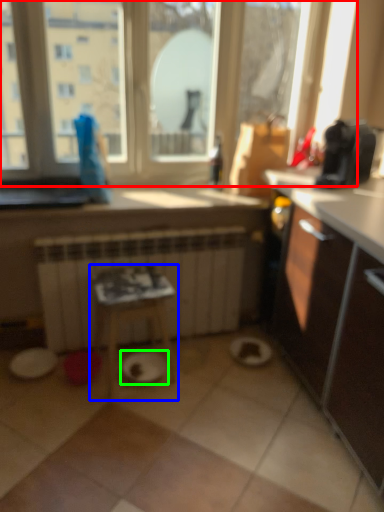
Question: Based on their relative distances, which object is farther from window (highlighted by a red box)? Choose from table (highlighted by a blue box) and paper plate (highlighted by a green box).

Choices:
 (A) table
 (B) paper plate

Answer: (B)